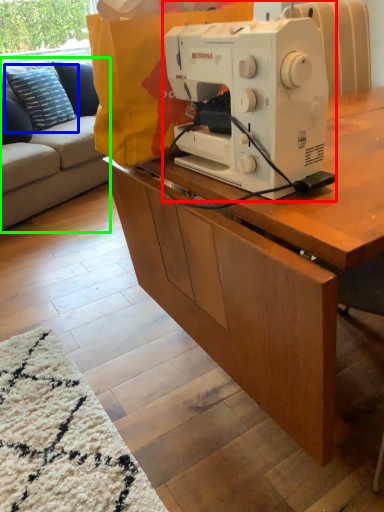
Question: Estimate the real-world distances between objects in this image. Which object is farther from sewing machine (highlighted by a red box), pillow (highlighted by a blue box) or studio couch (highlighted by a green box)?

Choices:
 (A) pillow
 (B) studio couch

Answer: (A)